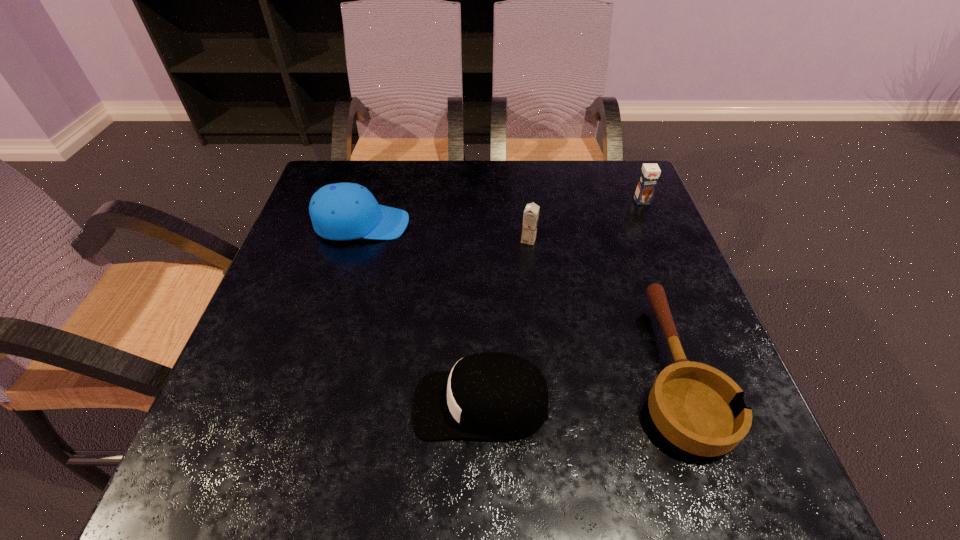
The image size is (960, 540). Identify the location of empty location between the left cap and the right cap. (421, 314).

Choose which object is the fourth nearest neighbor to the leftmost object. Please provide its 2D coordinates. Your answer should be formatted as a tuple, i.e. [(x, y)], where the tuple contains the x and y coordinates of a point satisfying the conditions above.

[(649, 175)]

Find the location of a particular element. object that stands as the third closest to the nearer cap is located at coordinates (342, 211).

Identify the location of free location that satisfies the following two spatial constraints: 1. with the handle on the side of the shortest object; 2. on the front-facing side of the left cap. The image size is (960, 540). (620, 224).

Locate an element on the screen. The height and width of the screenshot is (540, 960). free space that satisfies the following two spatial constraints: 1. on the front label of the farther chocolate milk; 2. on the front-facing side of the right cap is located at coordinates (728, 404).

At what (x,y) coordinates should I click in order to perform the action: click on free spot that satisfies the following two spatial constraints: 1. on the front label of the farthest object; 2. on the front-facing side of the right cap. Please return your answer as a coordinate pair (x, y). The image size is (960, 540). Looking at the image, I should click on (728, 404).

Image resolution: width=960 pixels, height=540 pixels. What are the coordinates of `free point that satisfies the following two spatial constraints: 1. on the back side of the left chocolate milk; 2. on the front-facing side of the leftmost object` in the screenshot? It's located at (527, 224).

Locate an element on the screen. vacant point that satisfies the following two spatial constraints: 1. on the front-facing side of the left chocolate milk; 2. on the left side of the leftmost object is located at coordinates (357, 240).